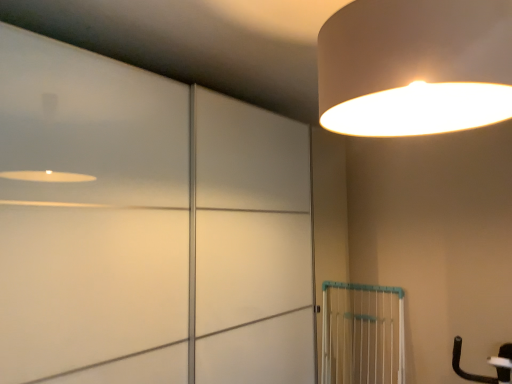
Question: Is point pyautogui.click(x=391, y=382) closer or farther from the camera than point pyautogui.click(x=403, y=96)?

Choices:
 (A) closer
 (B) farther

Answer: (B)

Question: Is white plastic gate at lower right in front of or behind matte white lampshade at upper right in the image?

Choices:
 (A) behind
 (B) front

Answer: (A)

Question: Which of these objects is positioned closest to the white matte sliding door at upper left?

Choices:
 (A) matte white lampshade at upper right
 (B) white plastic gate at lower right

Answer: (A)

Question: Which is nearer to the matte white lampshade at upper right?

Choices:
 (A) white matte sliding door at upper left
 (B) white plastic gate at lower right

Answer: (A)